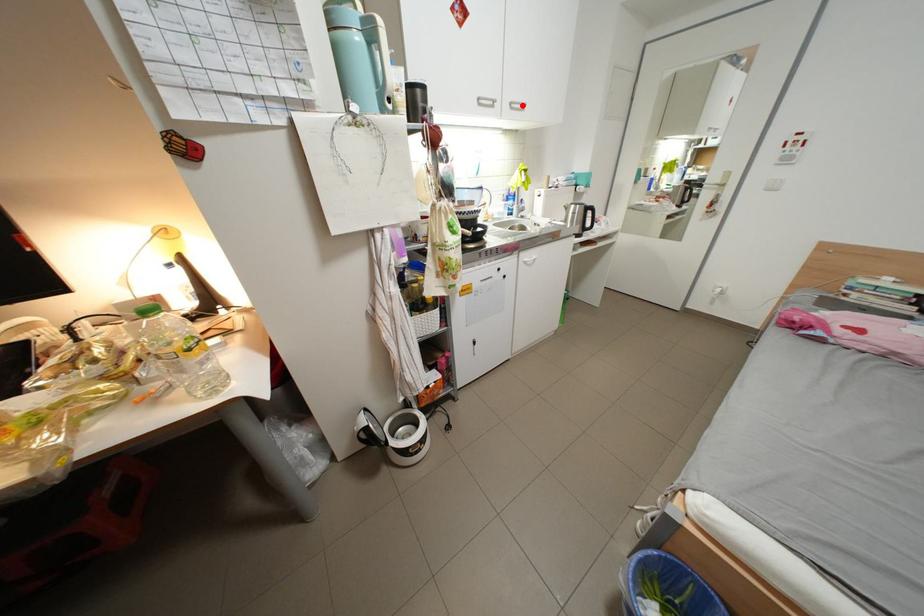
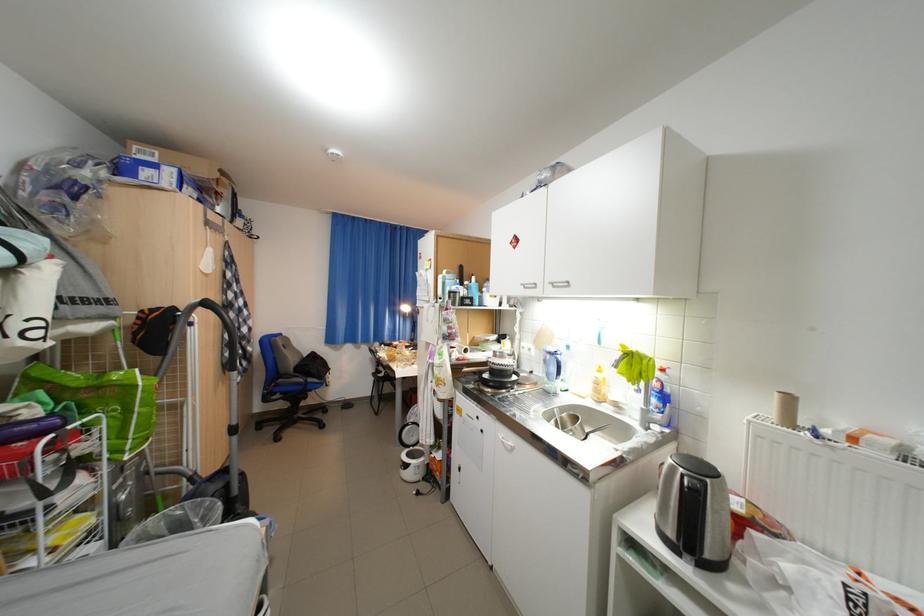
In the second image, find the point that corresponds to the highlighted location in the first image.

(564, 285)